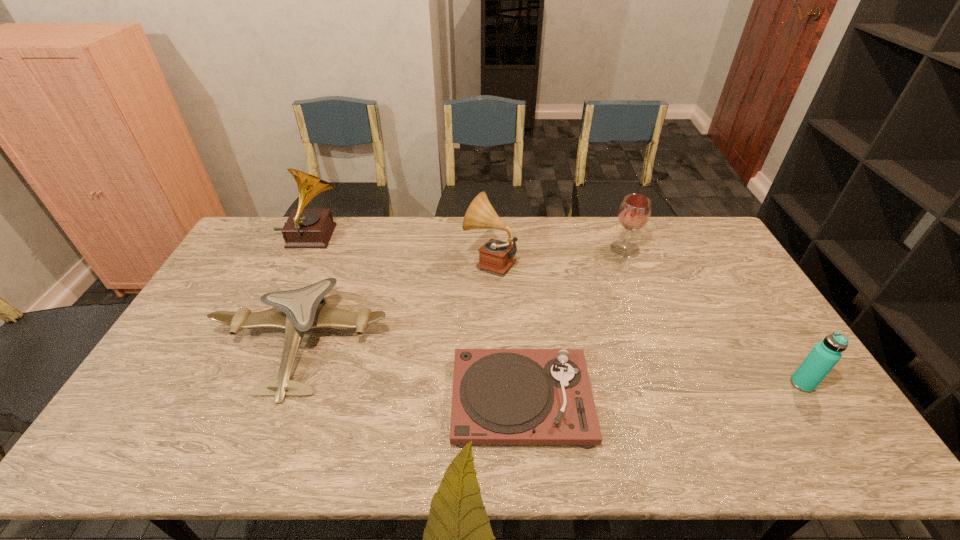
Identify the location of object that is at the far left corner. (305, 228).

In the image, there is a desktop. Where is `vacant space at the far edge`? This screenshot has height=540, width=960. vacant space at the far edge is located at coordinates (367, 225).

Where is `vacant space at the near edge of the desktop`? The height and width of the screenshot is (540, 960). vacant space at the near edge of the desktop is located at coordinates (610, 452).

The image size is (960, 540). In order to click on vacant space at the right edge in this screenshot , I will do `click(716, 295)`.

At what (x,y) coordinates should I click in order to perform the action: click on vacant area at the far left corner. Please return your answer as a coordinate pair (x, y). Looking at the image, I should click on (282, 217).

Find the location of a particular element. vacant region at the near left corner of the desktop is located at coordinates (150, 433).

The width and height of the screenshot is (960, 540). Find the location of `blank space at the far right corner`. blank space at the far right corner is located at coordinates (700, 249).

Where is `free spot between the second object from right to left and the fifth tallest object`? The width and height of the screenshot is (960, 540). free spot between the second object from right to left and the fifth tallest object is located at coordinates (463, 296).

Identify the location of vacant space in between the second tallest object and the fifth tallest object. Image resolution: width=960 pixels, height=540 pixels. (396, 302).

The height and width of the screenshot is (540, 960). Find the location of `free space between the drone and the second tallest object`. free space between the drone and the second tallest object is located at coordinates click(396, 302).